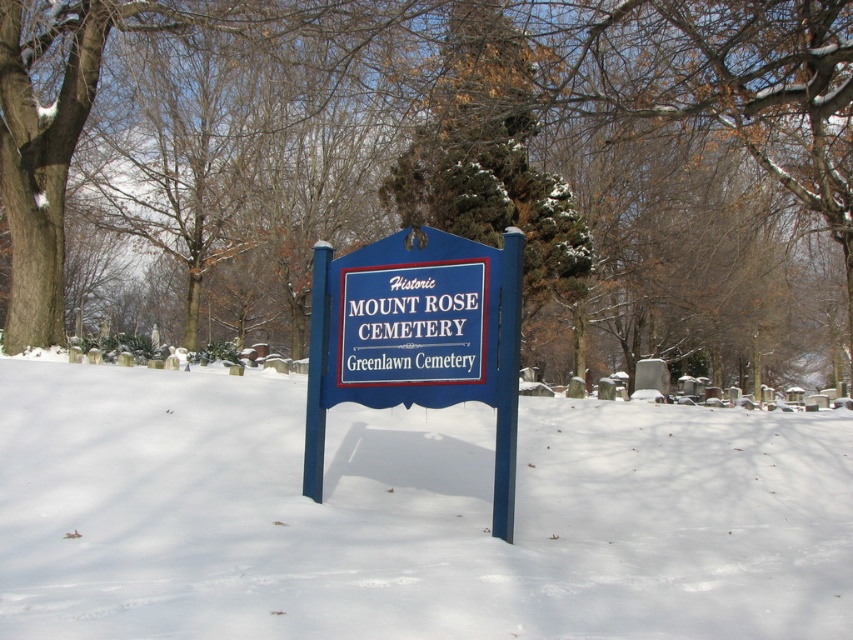
Is white powdery snow at center smaller than blue painted wood sign at center?

No.

Can you confirm if white powdery snow at center is positioned to the left of blue painted wood sign at center?

In fact, white powdery snow at center is to the right of blue painted wood sign at center.

Based on the photo, who is more distant from viewer, (577,420) or (381,268)?

The point (577,420) is more distant.

Identify the location of white powdery snow at center. The width and height of the screenshot is (853, 640). (408, 515).

Can you confirm if green textured evergreen at center is positioned below blue painted wood sign at center?

Incorrect, green textured evergreen at center is not positioned below blue painted wood sign at center.

Is point (730, 176) closer to viewer compared to point (456, 269)?

No.

Which is behind, point (181, 182) or point (509, 392)?

Positioned behind is point (181, 182).

This screenshot has width=853, height=640. In order to click on green textured evergreen at center in this screenshot , I will do `click(440, 164)`.

Does green textured evergreen at center come behind white powdery snow at center?

Yes.

Measure the distance between green textured evergreen at center and camera.

green textured evergreen at center is 19.48 feet from camera.

The width and height of the screenshot is (853, 640). Identify the location of green textured evergreen at center. (440, 164).